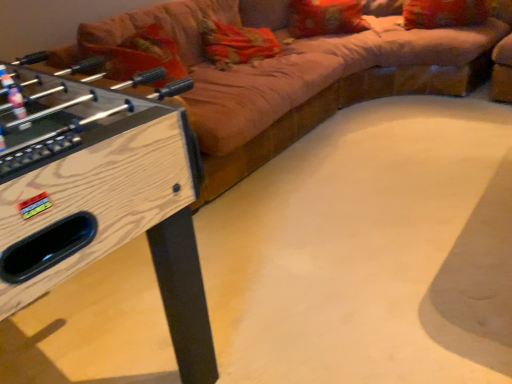
Question: Does orange fabric pillow at upper center, marked as the second pillow in a right-to-left arrangement, have a lesser height compared to velvet beige couch at upper center?

Choices:
 (A) no
 (B) yes

Answer: (B)

Question: Is orange fabric pillow at upper center, marked as the second pillow in a right-to-left arrangement, wider than velvet beige couch at upper center?

Choices:
 (A) yes
 (B) no

Answer: (B)

Question: Is orange fabric pillow at upper center, marked as the second pillow in a right-to-left arrangement, not within velvet beige couch at upper center?

Choices:
 (A) yes
 (B) no

Answer: (B)

Question: From a real-world perspective, is orange fabric pillow at upper center, marked as the second pillow in a right-to-left arrangement, below velvet beige couch at upper center?

Choices:
 (A) no
 (B) yes

Answer: (A)

Question: Is orange fabric pillow at upper center, marked as the second pillow in a right-to-left arrangement, looking in the opposite direction of velvet beige couch at upper center?

Choices:
 (A) yes
 (B) no

Answer: (A)

Question: From a real-world perspective, is orange fabric pillow at upper center, marked as the second pillow in a right-to-left arrangement, positioned over velvet beige couch at upper center based on gravity?

Choices:
 (A) no
 (B) yes

Answer: (B)

Question: Considering the relative positions of velvet beige couch at upper center and orange fabric pillow at upper center, marked as the second pillow in a right-to-left arrangement, in the image provided, is velvet beige couch at upper center in front of orange fabric pillow at upper center, marked as the second pillow in a right-to-left arrangement,?

Choices:
 (A) no
 (B) yes

Answer: (B)

Question: From the image's perspective, would you say velvet beige couch at upper center is shown under orange fabric pillow at upper center, marked as the second pillow in a right-to-left arrangement?

Choices:
 (A) no
 (B) yes

Answer: (B)

Question: Does velvet beige couch at upper center have a greater width compared to orange fabric pillow at upper center, the first pillow in the left-to-right sequence?

Choices:
 (A) no
 (B) yes

Answer: (B)

Question: Does velvet beige couch at upper center have a larger size compared to orange fabric pillow at upper center, marked as the second pillow in a right-to-left arrangement?

Choices:
 (A) yes
 (B) no

Answer: (A)

Question: Would you say velvet beige couch at upper center is a long distance from orange fabric pillow at upper center, the first pillow in the left-to-right sequence?

Choices:
 (A) no
 (B) yes

Answer: (A)

Question: Is velvet beige couch at upper center looking in the opposite direction of orange fabric pillow at upper center, marked as the second pillow in a right-to-left arrangement?

Choices:
 (A) yes
 (B) no

Answer: (A)

Question: Is velvet beige couch at upper center oriented away from velvet-like red pillow at upper right, which ranks as the 2th pillow in left-to-right order?

Choices:
 (A) yes
 (B) no

Answer: (B)